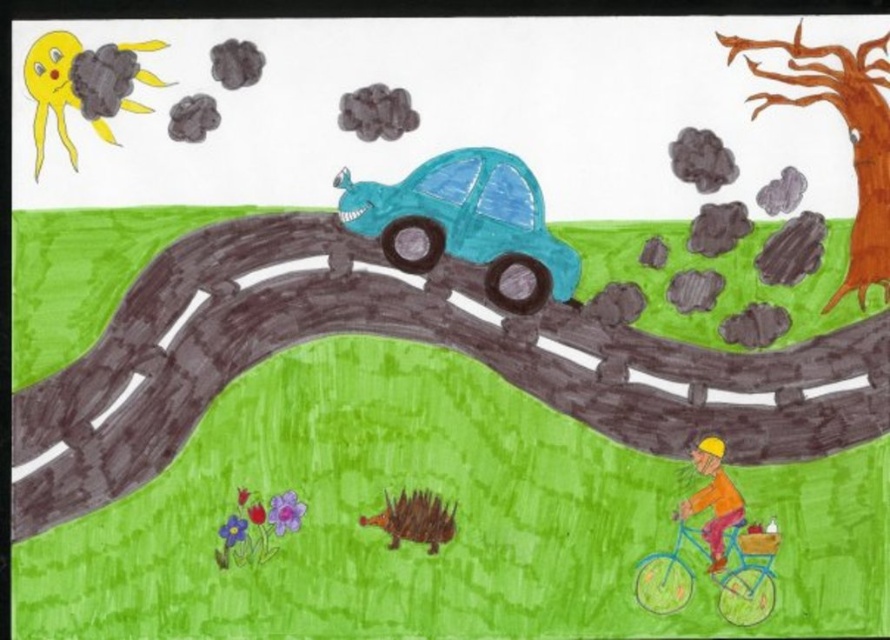
Does teal matte car at center appear on the left side of blue matte bicycle at lower right?

Indeed, teal matte car at center is positioned on the left side of blue matte bicycle at lower right.

Who is more distant from viewer, (490, 160) or (646, 593)?

The point (490, 160) is behind.

The height and width of the screenshot is (640, 890). What are the coordinates of `teal matte car at center` in the screenshot? It's located at (466, 211).

Is point (484, 154) closer to camera compared to point (694, 452)?

That is False.

Can you confirm if teal matte car at center is taller than orange matte bicycle rider at lower right?

Yes.

Between point (435, 209) and point (717, 458), which one is positioned behind?

Positioned behind is point (435, 209).

The width and height of the screenshot is (890, 640). Find the location of `teal matte car at center`. teal matte car at center is located at coordinates (466, 211).

Who is shorter, brown rough bark tree at upper right or blue matte bicycle at lower right?

Standing shorter between the two is blue matte bicycle at lower right.

Does brown rough bark tree at upper right appear under blue matte bicycle at lower right?

No, brown rough bark tree at upper right is not below blue matte bicycle at lower right.

This screenshot has height=640, width=890. Describe the element at coordinates (848, 134) in the screenshot. I see `brown rough bark tree at upper right` at that location.

Identify the location of brown rough bark tree at upper right. Image resolution: width=890 pixels, height=640 pixels. (848, 134).